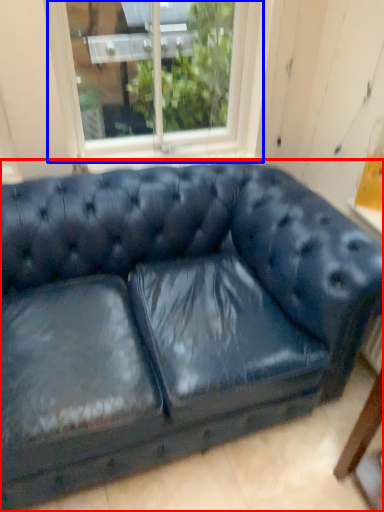
Question: Which object is further to the camera taking this photo, studio couch (highlighted by a red box) or window (highlighted by a blue box)?

Choices:
 (A) studio couch
 (B) window

Answer: (B)